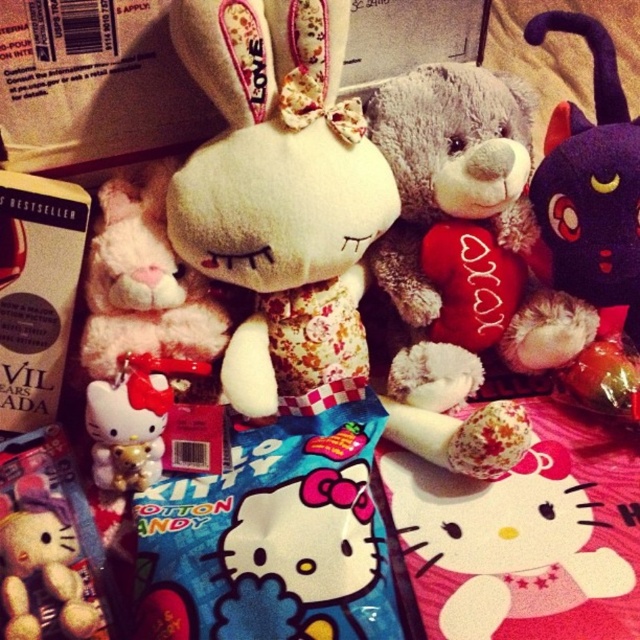
Who is positioned more to the right, fluffy white teddy bear at center or fluffy gray teddy bear at center?

Positioned to the right is fluffy gray teddy bear at center.

Is point (488, 465) closer to viewer compared to point (490, 180)?

Yes, point (488, 465) is closer to viewer.

Find the location of `fluffy white teddy bear at center`. fluffy white teddy bear at center is located at coordinates (280, 193).

Locate an element on the screen. The image size is (640, 640). fluffy white teddy bear at center is located at coordinates (280, 193).

Based on the photo, does fluffy plush toy at center have a greater width compared to white plush hello kitty at center?

Correct, the width of fluffy plush toy at center exceeds that of white plush hello kitty at center.

Which is behind, point (45, 605) or point (104, 484)?

The point (104, 484) is more distant.

Between point (74, 600) and point (100, 426), which one is positioned behind?

Point (100, 426)

The width and height of the screenshot is (640, 640). Find the location of `fluffy plush toy at center`. fluffy plush toy at center is located at coordinates (44, 566).

Is fluffy white teddy bear at center thinner than white plush hello kitty at center?

In fact, fluffy white teddy bear at center might be wider than white plush hello kitty at center.

Is fluffy white teddy bear at center above white plush hello kitty at center?

Yes, fluffy white teddy bear at center is above white plush hello kitty at center.

Does point (324, 161) lie behind point (152, 397)?

No, it is in front of (152, 397).

Find the location of a particular element. This screenshot has width=640, height=640. fluffy white teddy bear at center is located at coordinates (280, 193).